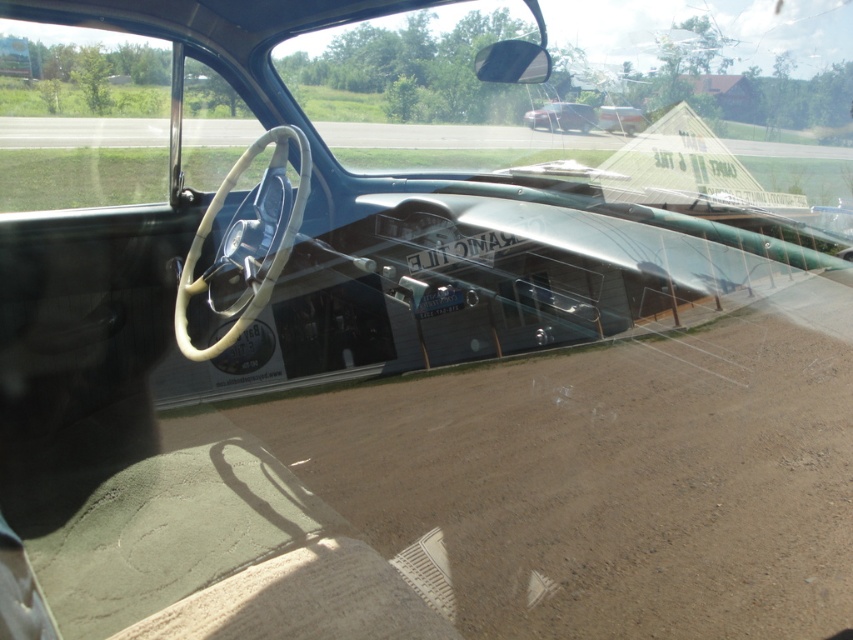
Question: Which point appears farthest from the camera in this image?

Choices:
 (A) (604, 129)
 (B) (525, 60)
 (C) (846, 445)

Answer: (A)

Question: Is glossy plastic view mirror at upper right below shiny metallic car at upper center?

Choices:
 (A) no
 (B) yes

Answer: (B)

Question: Does shiny metallic car at upper center have a larger size compared to metallic silver sedan at center?

Choices:
 (A) no
 (B) yes

Answer: (B)

Question: Does brown dirt track at center appear under metallic silver sedan at center?

Choices:
 (A) yes
 (B) no

Answer: (A)

Question: Which point is closer to the camera taking this photo?

Choices:
 (A) (514, 68)
 (B) (543, 120)
 (C) (613, 116)
 (D) (631, 544)

Answer: (D)

Question: Which object is the closest to the brown dirt track at center?

Choices:
 (A) glossy plastic view mirror at upper right
 (B) metallic silver sedan at center
 (C) shiny metallic car at upper center

Answer: (A)